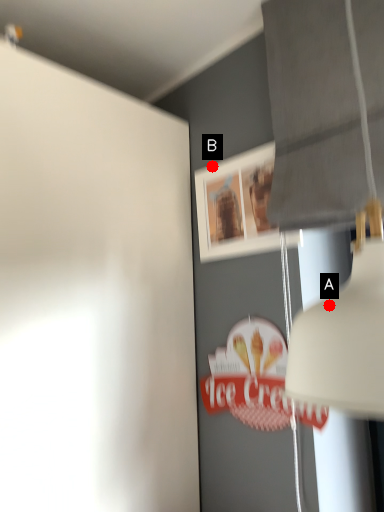
Question: Two points are circled on the image, labeled by A and B beside each circle. Which point appears farthest from the camera in this image?

Choices:
 (A) A is further
 (B) B is further

Answer: (B)